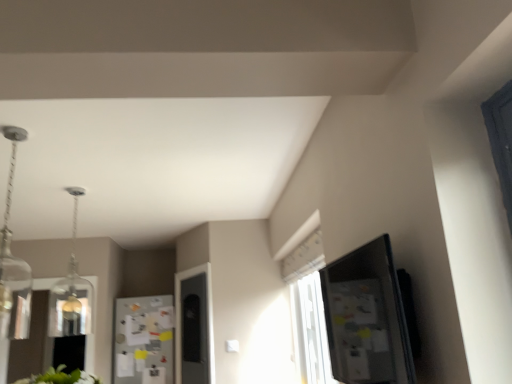
This screenshot has width=512, height=384. What are the coordinates of `clear glass pendant at upper left, the second light fixture positioned from the back` in the screenshot? It's located at [x=14, y=260].

From the image's perspective, is clear glass pendant light at upper left, which appears as the 2th light fixture when viewed from the front, positioned above or below white paperboard fridge at center?

From the image's perspective, clear glass pendant light at upper left, which appears as the 2th light fixture when viewed from the front, appears above white paperboard fridge at center.

Which object is further away from the camera taking this photo, clear glass pendant light at upper left, which appears as the 2th light fixture when viewed from the front, or white paperboard fridge at center?

white paperboard fridge at center is further away from the camera.

Based on the photo, is clear glass pendant light at upper left, which appears as the 2th light fixture when viewed from the front, oriented towards white paperboard fridge at center?

No.

Based on the photo, is clear glass pendant light at upper left, which appears as the 2th light fixture when viewed from the front, positioned far away from white paperboard fridge at center?

Actually, clear glass pendant light at upper left, which appears as the 2th light fixture when viewed from the front, and white paperboard fridge at center are a little close together.

In the scene shown: Which is more to the right, white paperboard fridge at center or clear glass pendant at upper left, the second light fixture positioned from the back?

From the viewer's perspective, clear glass pendant at upper left, the second light fixture positioned from the back, appears more on the right side.

There is a white paperboard fridge at center. Find the location of `the 2nd light fixture above it (from the image's perspective)`. the 2nd light fixture above it (from the image's perspective) is located at coordinates (14, 260).

Who is taller, white paperboard fridge at center or clear glass pendant at upper left, the 1th light fixture from the front?

white paperboard fridge at center is taller.

Is clear glass pendant light at upper left, which appears as the 2th light fixture when viewed from the front, spatially inside clear glass pendant at upper left, the 1th light fixture from the front, or outside of it?

clear glass pendant light at upper left, which appears as the 2th light fixture when viewed from the front, is spatially situated outside clear glass pendant at upper left, the 1th light fixture from the front.

How different are the orientations of clear glass pendant light at upper left, which appears as the 2th light fixture when viewed from the front, and clear glass pendant at upper left, the 1th light fixture from the front, in degrees?

There is a 180-degree angle between the facing directions of clear glass pendant light at upper left, which appears as the 2th light fixture when viewed from the front, and clear glass pendant at upper left, the 1th light fixture from the front.

Which is behind, clear glass pendant light at upper left, which appears as the 2th light fixture when viewed from the front, or clear glass pendant at upper left, the second light fixture positioned from the back?

clear glass pendant light at upper left, which appears as the 2th light fixture when viewed from the front, is more distant.

Is clear glass pendant light at upper left, which appears as the 2th light fixture when viewed from the front, taller than clear glass pendant at upper left, the second light fixture positioned from the back?

Yes, clear glass pendant light at upper left, which appears as the 2th light fixture when viewed from the front, is taller than clear glass pendant at upper left, the second light fixture positioned from the back.

From the image's perspective, which is above, white paperboard fridge at center or clear glass pendant light at upper left, which appears as the 2th light fixture when viewed from the front?

clear glass pendant light at upper left, which appears as the 2th light fixture when viewed from the front.

Considering the sizes of objects white paperboard fridge at center and clear glass pendant light at upper left, which appears as the 2th light fixture when viewed from the front, in the image provided, who is smaller, white paperboard fridge at center or clear glass pendant light at upper left, which appears as the 2th light fixture when viewed from the front,?

white paperboard fridge at center.

Is point (167, 308) closer or farther from the camera than point (65, 282)?

Point (167, 308) appears to be farther away from the viewer than point (65, 282).

Is white paperboard fridge at center situated inside clear glass pendant light at upper left, which appears as the 2th light fixture when viewed from the front, or outside?

white paperboard fridge at center is not enclosed by clear glass pendant light at upper left, which appears as the 2th light fixture when viewed from the front.

Is clear glass pendant at upper left, the 1th light fixture from the front, positioned far away from clear glass pendant light at upper left, which appears as the 2th light fixture when viewed from the front?

clear glass pendant at upper left, the 1th light fixture from the front, is actually quite close to clear glass pendant light at upper left, which appears as the 2th light fixture when viewed from the front.

Is clear glass pendant at upper left, the 1th light fixture from the front, taller or shorter than clear glass pendant light at upper left, which appears as the 2th light fixture when viewed from the front?

Clearly, clear glass pendant at upper left, the 1th light fixture from the front, is shorter compared to clear glass pendant light at upper left, which appears as the 2th light fixture when viewed from the front.

Considering the relative sizes of clear glass pendant at upper left, the second light fixture positioned from the back, and clear glass pendant light at upper left, which appears as the 2th light fixture when viewed from the front, in the image provided, is clear glass pendant at upper left, the second light fixture positioned from the back, bigger than clear glass pendant light at upper left, which appears as the 2th light fixture when viewed from the front,?

Incorrect, clear glass pendant at upper left, the second light fixture positioned from the back, is not larger than clear glass pendant light at upper left, which appears as the 2th light fixture when viewed from the front.

You are a GUI agent. You are given a task and a screenshot of the screen. Output one action in this format:
    pyautogui.click(x=<x>, y=<y>)
    Task: Click on the light fixture to the left of clear glass pendant at upper left, the 1th light fixture from the front
    The image size is (512, 384).
    Given the screenshot: What is the action you would take?
    pyautogui.click(x=71, y=292)

Is clear glass pendant at upper left, the 1th light fixture from the front, inside the boundaries of white paperboard fridge at center, or outside?

clear glass pendant at upper left, the 1th light fixture from the front, is located beyond the bounds of white paperboard fridge at center.

Which is more to the left, clear glass pendant at upper left, the second light fixture positioned from the back, or white paperboard fridge at center?

From the viewer's perspective, white paperboard fridge at center appears more on the left side.

From a real-world perspective, is clear glass pendant at upper left, the 1th light fixture from the front, positioned above or below white paperboard fridge at center?

clear glass pendant at upper left, the 1th light fixture from the front, is situated higher than white paperboard fridge at center in the real world.

Identify the location of fridge behind the clear glass pendant light at upper left, which appears as the 2th light fixture when viewed from the front. Image resolution: width=512 pixels, height=384 pixels. click(143, 340).

You are a GUI agent. You are given a task and a screenshot of the screen. Output one action in this format:
    pyautogui.click(x=<x>, y=<y>)
    Task: Click on the light fixture located on the right of white paperboard fridge at center
    This screenshot has width=512, height=384.
    Given the screenshot: What is the action you would take?
    pyautogui.click(x=14, y=260)

Considering their positions, is clear glass pendant light at upper left, which ranks as the first light fixture in back-to-front order, positioned closer to clear glass pendant at upper left, the second light fixture positioned from the back, than white paperboard fridge at center?

clear glass pendant light at upper left, which ranks as the first light fixture in back-to-front order, is positioned closer to the anchor clear glass pendant at upper left, the second light fixture positioned from the back.

Considering their positions, is clear glass pendant at upper left, the second light fixture positioned from the back, positioned closer to clear glass pendant light at upper left, which appears as the 2th light fixture when viewed from the front, than white paperboard fridge at center?

The object closer to clear glass pendant light at upper left, which appears as the 2th light fixture when viewed from the front, is clear glass pendant at upper left, the second light fixture positioned from the back.

Considering their positions, is clear glass pendant light at upper left, which ranks as the first light fixture in back-to-front order, positioned further to white paperboard fridge at center than clear glass pendant at upper left, the 1th light fixture from the front?

Among the two, clear glass pendant at upper left, the 1th light fixture from the front, is located further to white paperboard fridge at center.

From the image, which object appears to be farther from clear glass pendant at upper left, the 1th light fixture from the front, white paperboard fridge at center or clear glass pendant light at upper left, which ranks as the first light fixture in back-to-front order?

white paperboard fridge at center.

Estimate the real-world distances between objects in this image. Which object is closer to white paperboard fridge at center, clear glass pendant at upper left, the second light fixture positioned from the back, or clear glass pendant light at upper left, which ranks as the first light fixture in back-to-front order?

clear glass pendant light at upper left, which ranks as the first light fixture in back-to-front order, is closer to white paperboard fridge at center.

Based on their spatial positions, is white paperboard fridge at center or clear glass pendant at upper left, the 1th light fixture from the front, closer to clear glass pendant light at upper left, which appears as the 2th light fixture when viewed from the front?

clear glass pendant at upper left, the 1th light fixture from the front.

Identify the location of light fixture between clear glass pendant at upper left, the 1th light fixture from the front, and white paperboard fridge at center from front to back. Image resolution: width=512 pixels, height=384 pixels. (71, 292).